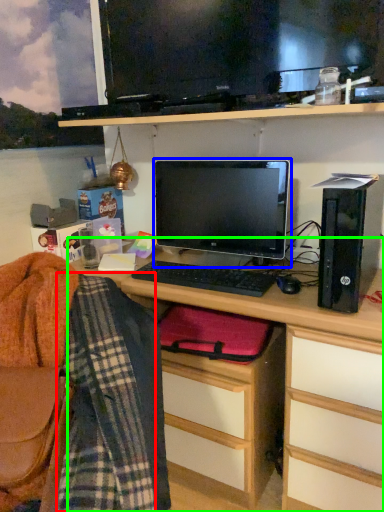
Question: Which object is the closest to the plaid (highlighted by a red box)? Choose among these: computer monitor (highlighted by a blue box) or desk (highlighted by a green box).

Choices:
 (A) computer monitor
 (B) desk

Answer: (B)